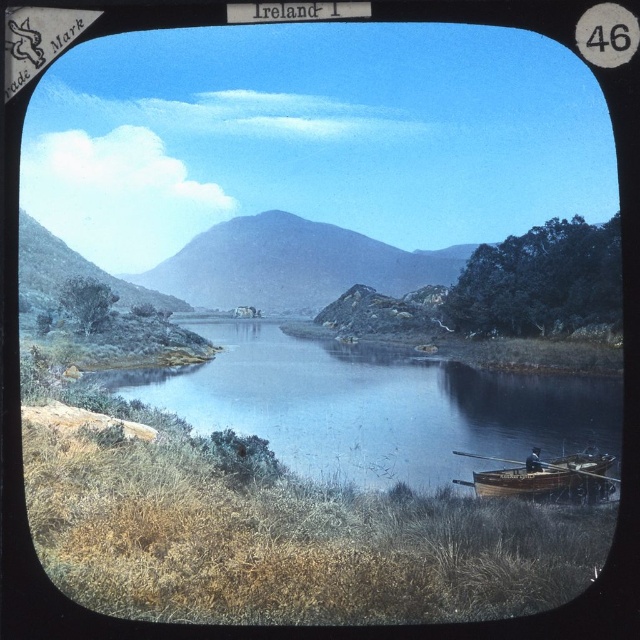
Looking at this image, who is taller, blue smooth water at center or wooden canoe at lower right?

blue smooth water at center is taller.

What do you see at coordinates (374, 404) in the screenshot? This screenshot has height=640, width=640. I see `blue smooth water at center` at bounding box center [374, 404].

Which is behind, point (387, 388) or point (582, 484)?

Point (387, 388)

This screenshot has height=640, width=640. I want to click on blue smooth water at center, so click(374, 404).